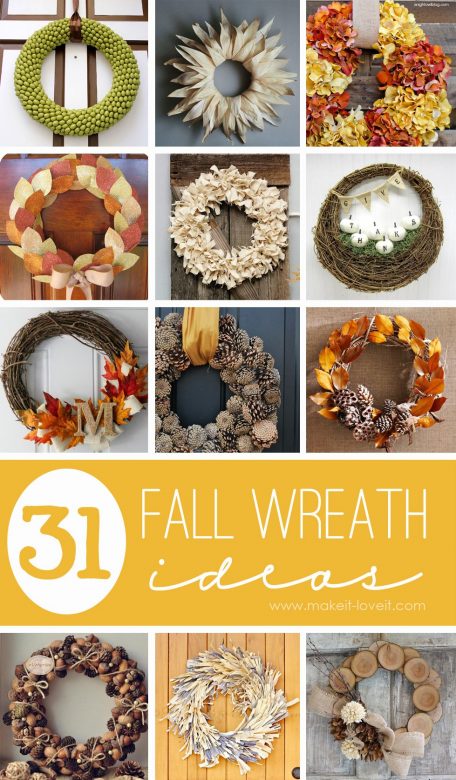
Locate an element on the screen. The width and height of the screenshot is (456, 780). wood slices is located at coordinates (366, 668), (424, 671), (427, 704).